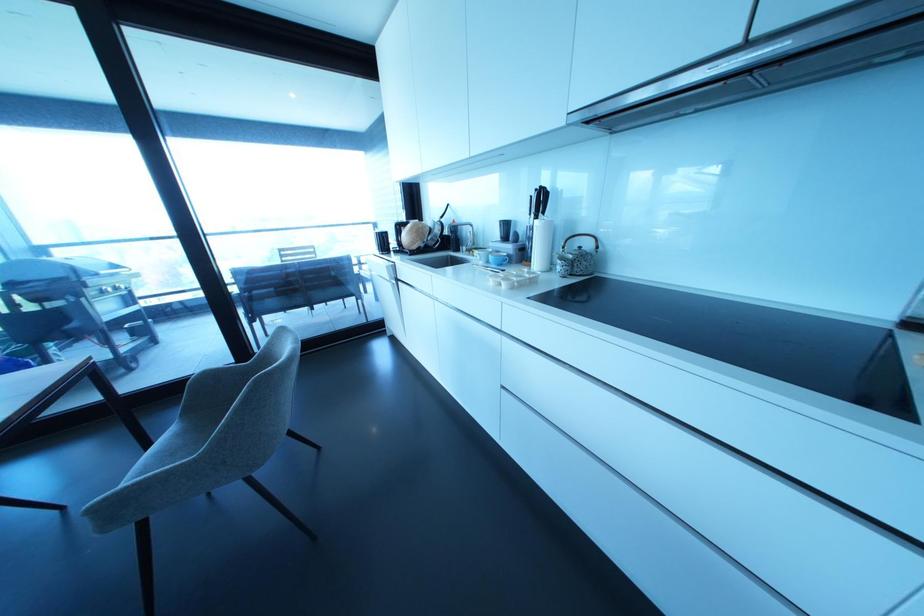
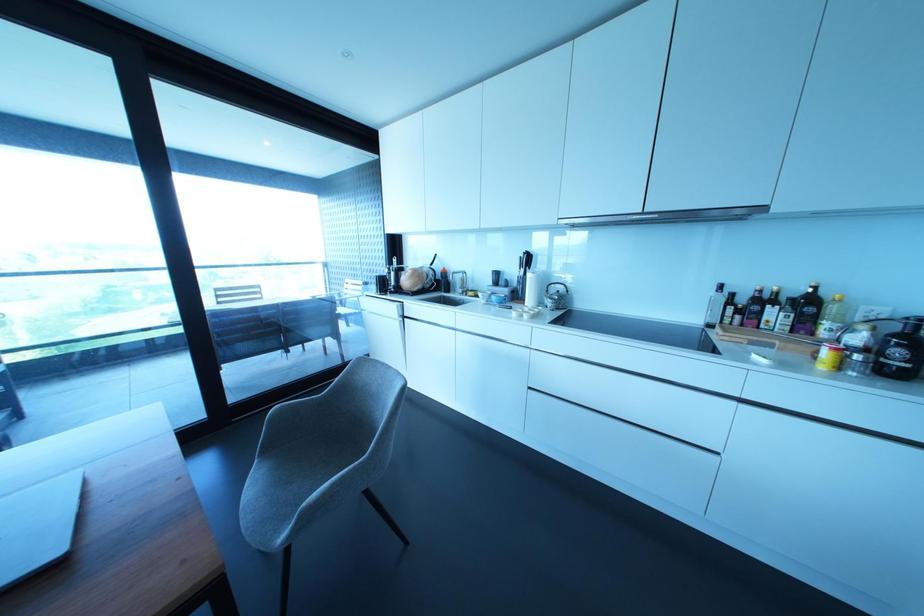
Find the pixel in the second image that matches pixel 104 499 in the first image.

(323, 493)